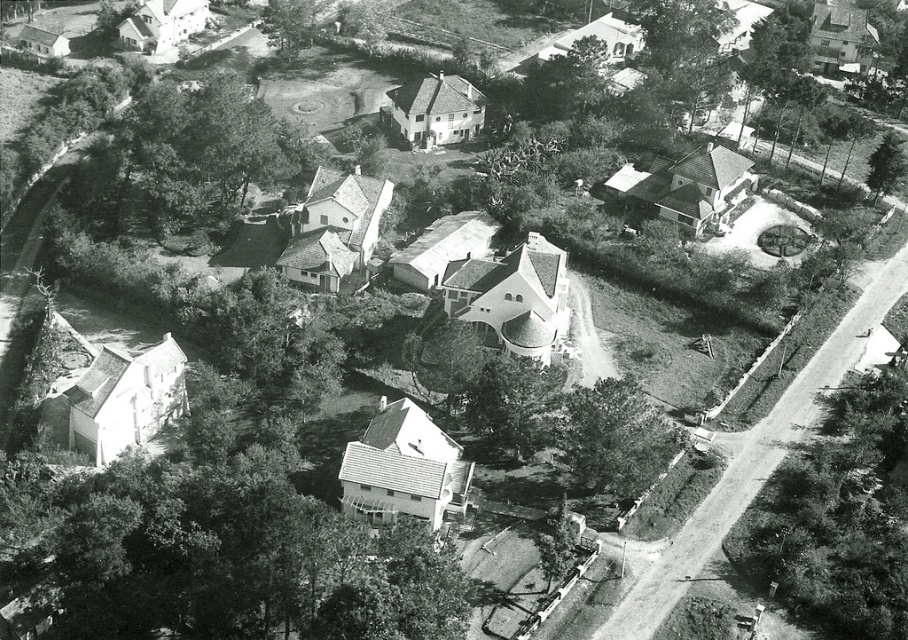
Who is shorter, smooth bark tree at upper right or green leafy tree at upper center?

green leafy tree at upper center is shorter.

From the picture: Who is more forward, (x=709, y=44) or (x=292, y=22)?

Point (x=709, y=44)

The image size is (908, 640). I want to click on smooth bark tree at upper right, so click(684, 49).

Does green leafy tree at center come behind green textured tree at right?

No, it is in front of green textured tree at right.

Who is higher up, green leafy tree at center or green textured tree at right?

green textured tree at right is higher up.

Which is behind, point (536, 396) or point (883, 173)?

The point (883, 173) is behind.

At what (x,y) coordinates should I click in order to perform the action: click on green leafy tree at center. Please return your answer as a coordinate pair (x, y). This screenshot has height=640, width=908. Looking at the image, I should click on pos(514,403).

How much distance is there between dark green leafy tree at lower right and green leafy tree at upper center?

dark green leafy tree at lower right and green leafy tree at upper center are 111.06 meters apart.

Can you confirm if dark green leafy tree at lower right is bigger than green leafy tree at upper center?

Yes.

Is point (579, 387) less distant than point (282, 3)?

That is True.

Identify the location of dark green leafy tree at lower right. (615, 436).